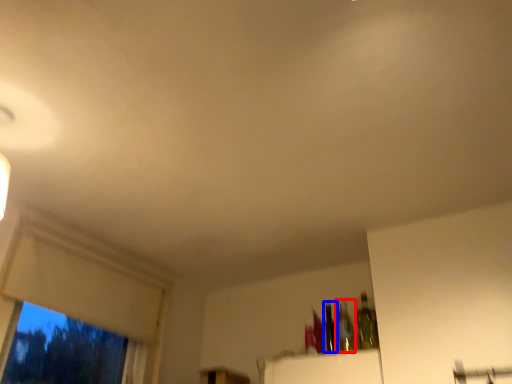
Question: Which object is further to the camera taking this photo, bottle (highlighted by a red box) or bottle (highlighted by a blue box)?

Choices:
 (A) bottle
 (B) bottle

Answer: (B)